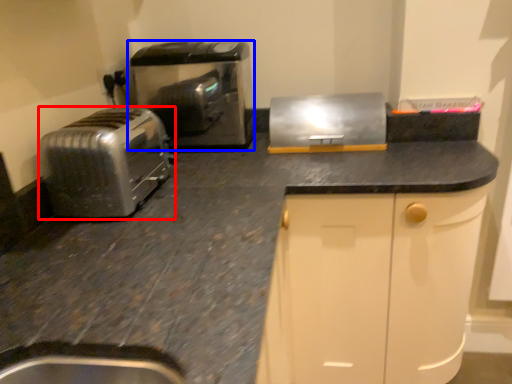
Question: Among these objects, which one is farthest to the camera, toaster (highlighted by a red box) or home appliance (highlighted by a blue box)?

Choices:
 (A) toaster
 (B) home appliance

Answer: (B)